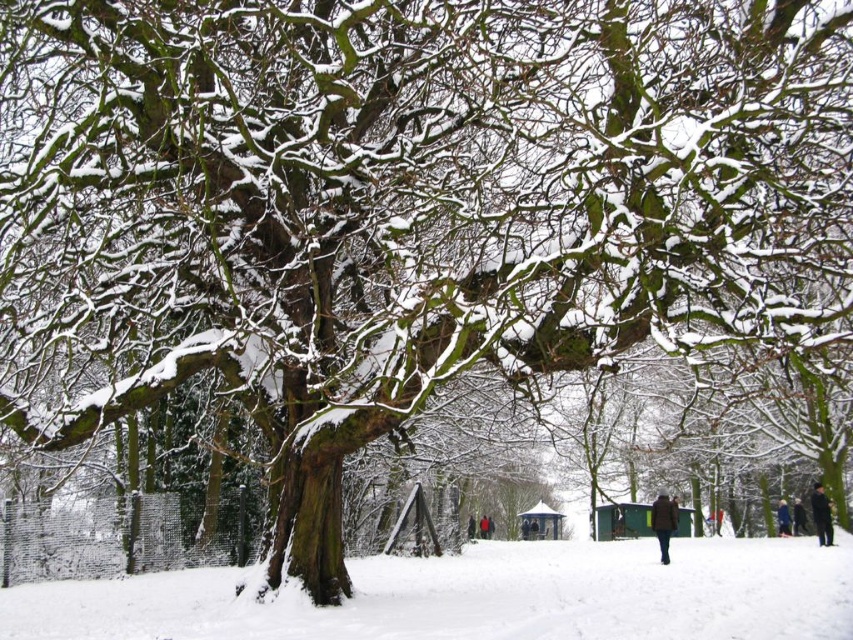
This screenshot has width=853, height=640. What do you see at coordinates (479, 596) in the screenshot? I see `white fluffy snow at lower center` at bounding box center [479, 596].

Can you confirm if white fluffy snow at lower center is thinner than dark blue jacket at lower right?

No, white fluffy snow at lower center is not thinner than dark blue jacket at lower right.

Does point (28, 586) come closer to viewer compared to point (784, 508)?

Yes, it is in front of point (784, 508).

Where is `white fluffy snow at lower center`? The height and width of the screenshot is (640, 853). white fluffy snow at lower center is located at coordinates (479, 596).

Does dark brown coat at center have a greater height compared to black fabric person at lower right?

Correct, dark brown coat at center is much taller as black fabric person at lower right.

Looking at this image, can you confirm if dark brown coat at center is bigger than black fabric person at lower right?

Indeed, dark brown coat at center has a larger size compared to black fabric person at lower right.

Find the location of a particular element. This screenshot has width=853, height=640. dark brown coat at center is located at coordinates coord(663,522).

The image size is (853, 640). Identify the location of dark brown coat at center. (663, 522).

Between dark blue jacket at lower right and black wool coat at lower right, which one appears on the left side from the viewer's perspective?

From the viewer's perspective, black wool coat at lower right appears more on the left side.

Find the location of a particular element. The width and height of the screenshot is (853, 640). dark blue jacket at lower right is located at coordinates pyautogui.click(x=782, y=518).